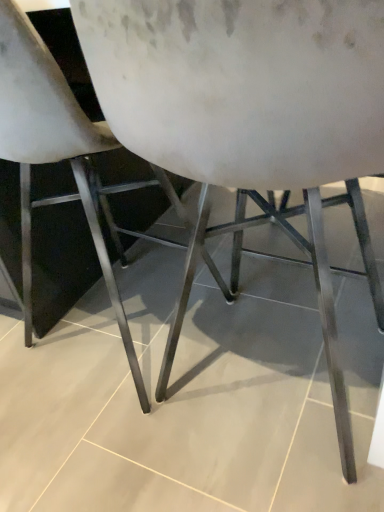
This screenshot has height=512, width=384. What do you see at coordinates (51, 148) in the screenshot?
I see `white matte chair at center` at bounding box center [51, 148].

Measure the distance between white matte chair at center and camera.

white matte chair at center and camera are 21.44 inches apart from each other.

Identify the location of white matte chair at center. The width and height of the screenshot is (384, 512). (51, 148).

Find the location of `white matte chair at center`. white matte chair at center is located at coordinates tap(51, 148).